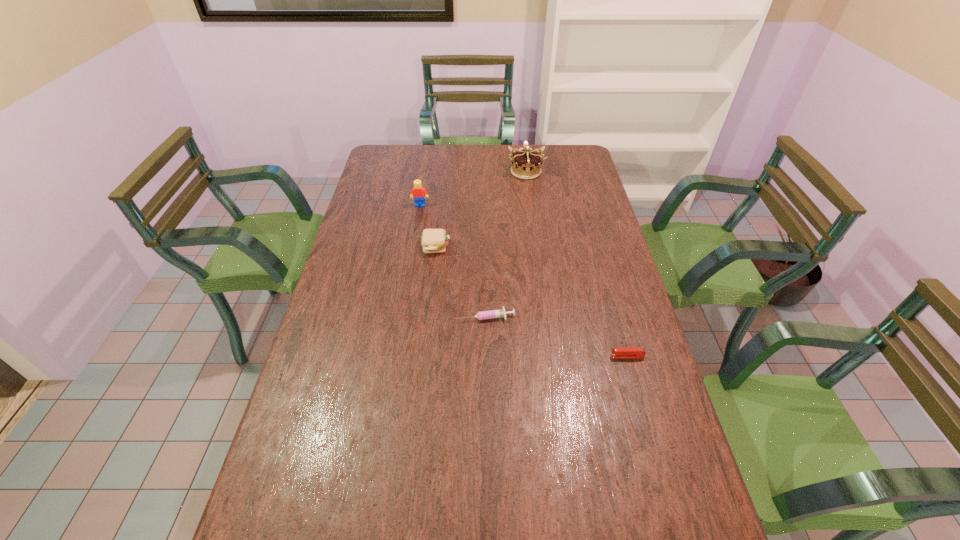
Image resolution: width=960 pixels, height=540 pixels. What are the coordinates of `vacant space located 0.160m on the face of the fourth nearest object` in the screenshot? It's located at (416, 234).

In order to click on vacant area situated 0.320m on the right of the third farthest object in this screenshot , I will do `click(542, 247)`.

You are a GUI agent. You are given a task and a screenshot of the screen. Output one action in this format:
    pyautogui.click(x=<x>, y=<y>)
    Task: Click on the vacant space situated on the front-facing side of the nearest object
    The height and width of the screenshot is (540, 960).
    Given the screenshot: What is the action you would take?
    pyautogui.click(x=570, y=356)

Identify the location of vacant region located on the front-facing side of the nearest object. (541, 356).

Identify the location of vacant space situated 0.240m on the front-facing side of the nearest object. (523, 356).

You are a GUI agent. You are given a task and a screenshot of the screen. Output one action in this format:
    pyautogui.click(x=<x>, y=<y>)
    Task: Click on the vacant area situated on the right of the syringe
    The height and width of the screenshot is (540, 960).
    Given the screenshot: What is the action you would take?
    pyautogui.click(x=568, y=316)

Locate an element on the screen. This screenshot has width=960, height=540. object present at the far edge is located at coordinates (526, 164).

This screenshot has height=540, width=960. Find the location of `object at the right edge`. object at the right edge is located at coordinates (619, 352).

Locate an element on the screen. free spot at the far edge of the desktop is located at coordinates (493, 152).

Identify the location of free region at the left edge of the desktop. (365, 231).